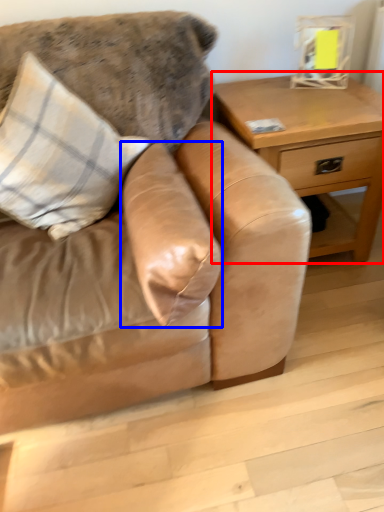
Question: Which point is further to the camera, table (highlighted by a red box) or pillow (highlighted by a blue box)?

Choices:
 (A) table
 (B) pillow

Answer: (A)